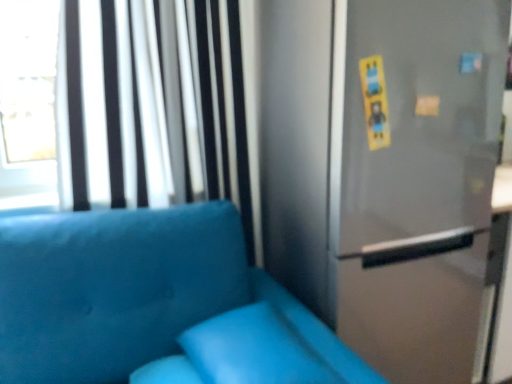
Question: Can you confirm if satin silver screen door at upper right is smaller than white/textured curtain at upper left?

Choices:
 (A) no
 (B) yes

Answer: (B)

Question: Can we say satin silver screen door at upper right lies outside white/textured curtain at upper left?

Choices:
 (A) yes
 (B) no

Answer: (A)

Question: Does satin silver screen door at upper right lie in front of white/textured curtain at upper left?

Choices:
 (A) no
 (B) yes

Answer: (B)

Question: Could you tell me if satin silver screen door at upper right is turned towards white/textured curtain at upper left?

Choices:
 (A) yes
 (B) no

Answer: (B)

Question: Considering the relative sizes of satin silver screen door at upper right and white/textured curtain at upper left in the image provided, is satin silver screen door at upper right wider than white/textured curtain at upper left?

Choices:
 (A) yes
 (B) no

Answer: (B)

Question: Does satin silver screen door at upper right appear on the right side of white/textured curtain at upper left?

Choices:
 (A) yes
 (B) no

Answer: (A)

Question: Considering the relative sizes of suede blue couch at lower left and white/textured curtain at upper left in the image provided, is suede blue couch at lower left wider than white/textured curtain at upper left?

Choices:
 (A) no
 (B) yes

Answer: (B)

Question: Can you confirm if suede blue couch at lower left is taller than white/textured curtain at upper left?

Choices:
 (A) no
 (B) yes

Answer: (A)

Question: Is suede blue couch at lower left oriented towards white/textured curtain at upper left?

Choices:
 (A) yes
 (B) no

Answer: (B)

Question: Is suede blue couch at lower left in contact with white/textured curtain at upper left?

Choices:
 (A) no
 (B) yes

Answer: (A)

Question: Does suede blue couch at lower left have a lesser width compared to white/textured curtain at upper left?

Choices:
 (A) no
 (B) yes

Answer: (A)

Question: Would you consider suede blue couch at lower left to be distant from white/textured curtain at upper left?

Choices:
 (A) no
 (B) yes

Answer: (A)

Question: From a real-world perspective, is white/textured curtain at upper left below matte blue pillow at lower center?

Choices:
 (A) yes
 (B) no

Answer: (B)